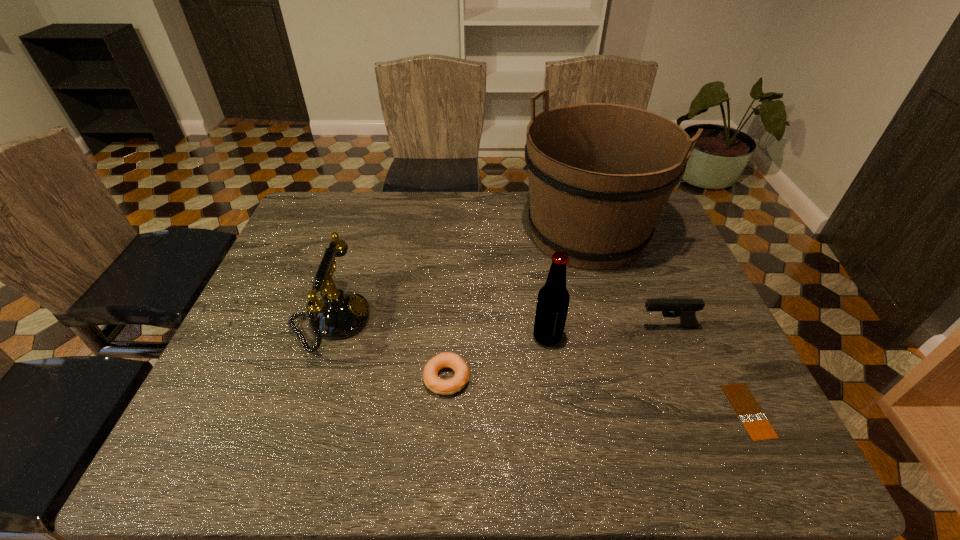
Find the location of `the tallest object`. the tallest object is located at coordinates (600, 174).

The image size is (960, 540). Identify the location of the farthest object. (600, 174).

Image resolution: width=960 pixels, height=540 pixels. In order to click on the second tallest object in this screenshot , I will do `click(553, 299)`.

Locate an element on the screen. the leftmost object is located at coordinates (337, 315).

Where is `the third tallest object`? the third tallest object is located at coordinates (337, 315).

In order to click on pistol in this screenshot , I will do pos(685,309).

Where is `bagel`? This screenshot has height=540, width=960. bagel is located at coordinates (437, 385).

The height and width of the screenshot is (540, 960). Find the location of `the second object from left to right`. the second object from left to right is located at coordinates (437, 385).

Identify the location of the shortest object. The height and width of the screenshot is (540, 960). (751, 415).

Locate an element on the screen. The width and height of the screenshot is (960, 540). free space located 0.220m on the front of the bucket is located at coordinates (619, 342).